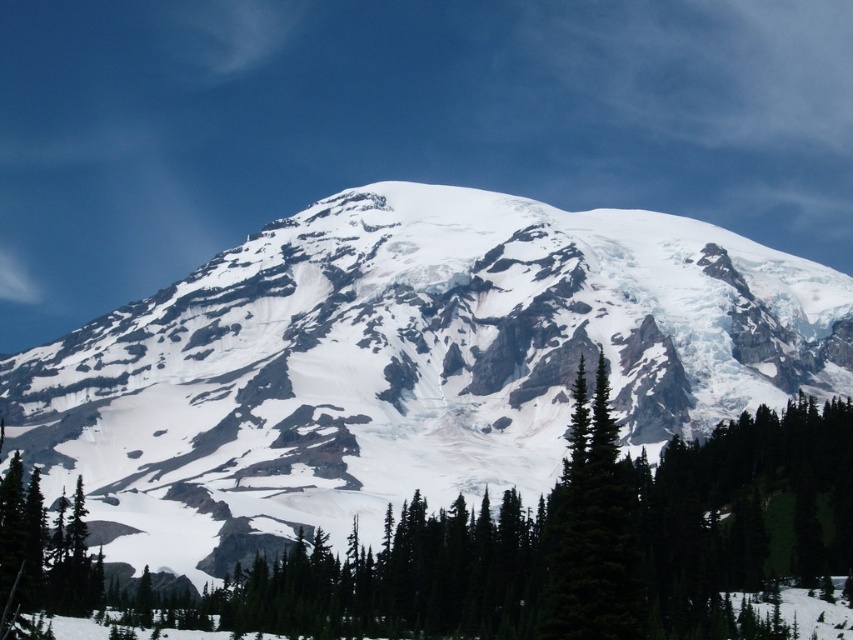
Who is positioned more to the right, white snow-covered mountain at center or green matte tree at center?

Positioned to the right is green matte tree at center.

Can you confirm if white snow-covered mountain at center is thinner than green matte tree at center?

Incorrect, white snow-covered mountain at center's width is not less than green matte tree at center's.

The image size is (853, 640). Describe the element at coordinates (405, 364) in the screenshot. I see `white snow-covered mountain at center` at that location.

Locate an element on the screen. The width and height of the screenshot is (853, 640). white snow-covered mountain at center is located at coordinates (405, 364).